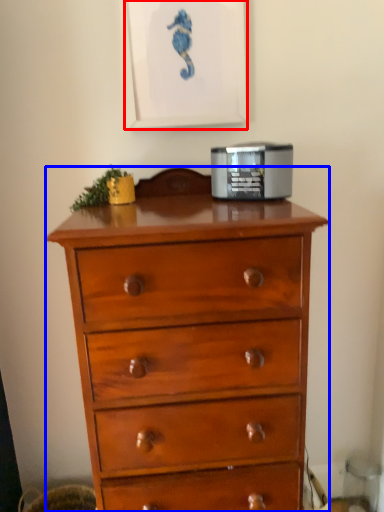
Question: Among these objects, which one is nearest to the camera, picture frame (highlighted by a red box) or chest of drawers (highlighted by a blue box)?

Choices:
 (A) picture frame
 (B) chest of drawers

Answer: (B)